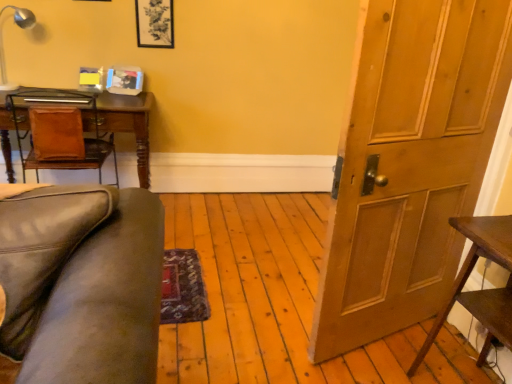
The height and width of the screenshot is (384, 512). Find the location of `blank space to the left of wooden door at right`. blank space to the left of wooden door at right is located at coordinates (256, 314).